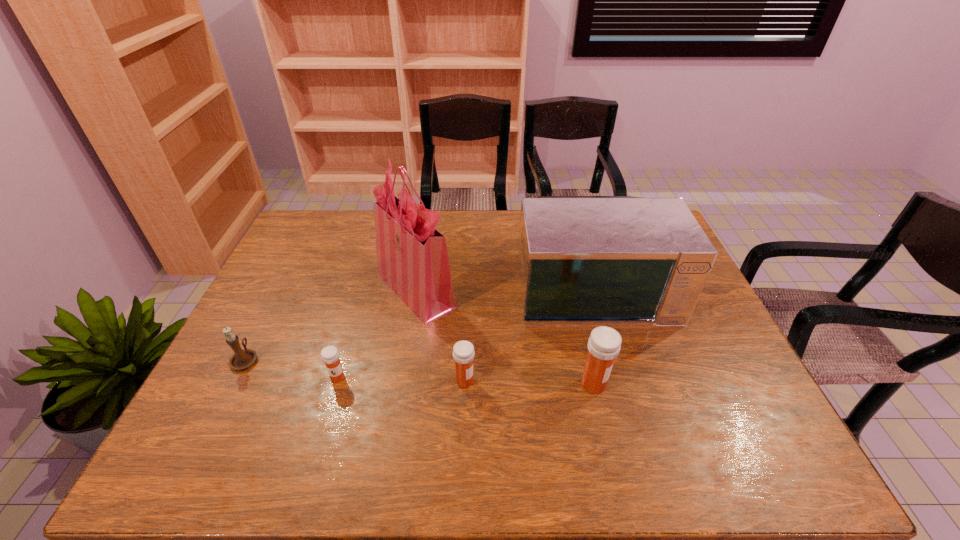
Where is `vacant area that satisfies the following two spatial constraints: 1. on the front-facing side of the microwave oven; 2. on the label side of the rightmost medicine`? The image size is (960, 540). vacant area that satisfies the following two spatial constraints: 1. on the front-facing side of the microwave oven; 2. on the label side of the rightmost medicine is located at coordinates tap(622, 384).

Identify the location of free space that satisfies the following two spatial constraints: 1. on the side of the tallest object with the handle; 2. on the left side of the candle holder. (280, 290).